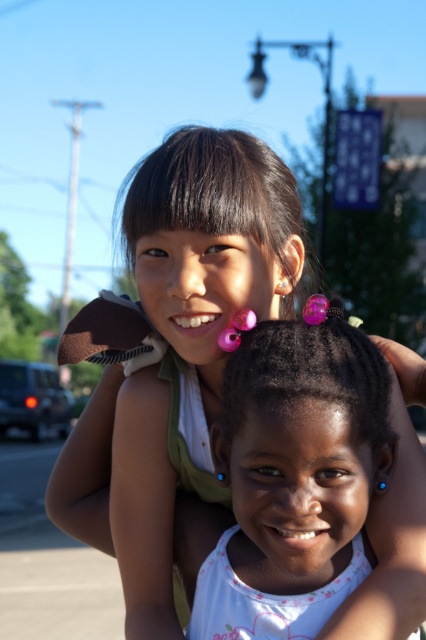
You are a photographer trying to capture the perfect shot of the two girls in the image. You want to focus on the black shiny hair at upper center. Where exactly should you aim your camera to capture it?

You should aim your camera at point 0.309 on the x axis and 0.512 on the y axis to capture the black shiny hair at upper center.

You are a photographer setting up for a group photo. You need to arrange the two girls so that their hair accessories are visible. Given the black shiny hair at upper center and the purple glossy hair at center, which girl should stand in front to ensure both hair accessories are visible?

The girl with the black shiny hair at upper center should stand in front because her hair is taller than the purple glossy hair at center, ensuring both are visible.

You are a photographer standing 1.5 meters away from the camera. You want to take a photo of the matte green shirt at upper center. Can you reach it without moving your position?

The matte green shirt at upper center is 1.38 meters away from the camera. Since you are standing 1.5 meters away from the camera, you are 0.12 meters farther than the shirt. Therefore, you can reach it without moving your position.